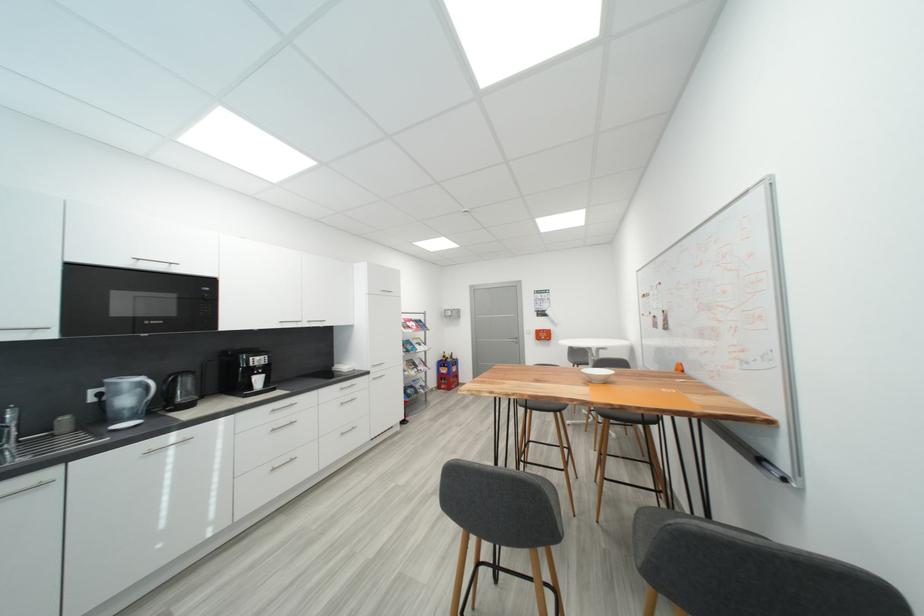
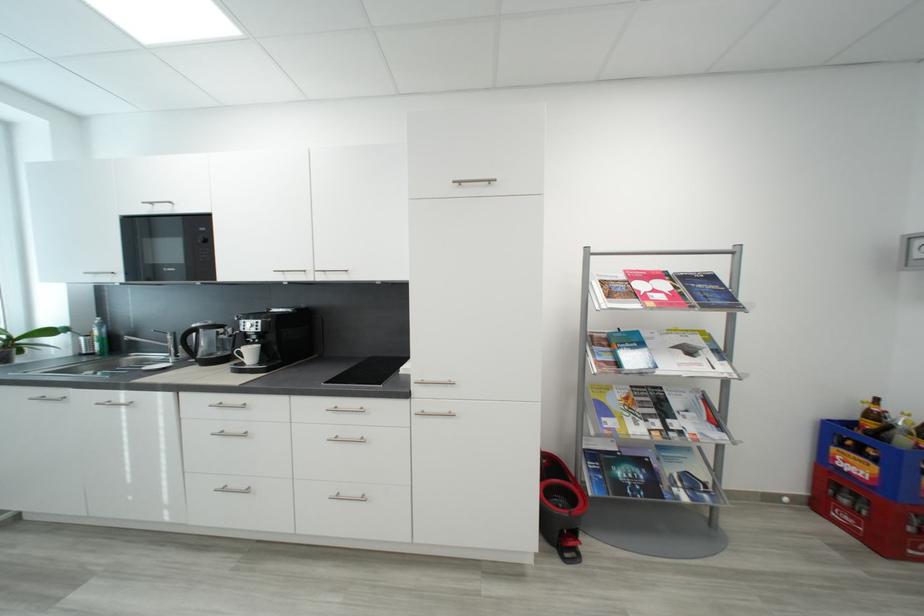
In the second image, find the point that corresponds to (419,389) in the first image.

(650, 464)